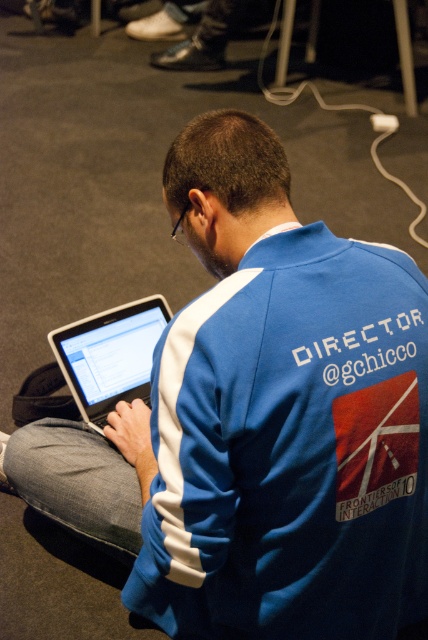
Question: Is gray fabric lap at lower left smaller than satin silver laptop at center?

Choices:
 (A) yes
 (B) no

Answer: (B)

Question: Can you confirm if gray fabric lap at lower left is positioned below satin silver laptop at center?

Choices:
 (A) yes
 (B) no

Answer: (A)

Question: Which point is closer to the camera?

Choices:
 (A) gray fabric lap at lower left
 (B) satin silver laptop at center
 (C) blue fabric sweatshirt at center

Answer: (C)

Question: Based on their relative distances, which object is nearer to the blue fabric sweatshirt at center?

Choices:
 (A) gray fabric lap at lower left
 (B) satin silver laptop at center

Answer: (A)

Question: From the image, what is the correct spatial relationship of blue fabric sweatshirt at center in relation to satin silver laptop at center?

Choices:
 (A) right
 (B) left

Answer: (A)

Question: Among these points, which one is farthest from the camera?

Choices:
 (A) (127, 349)
 (B) (285, 584)

Answer: (A)